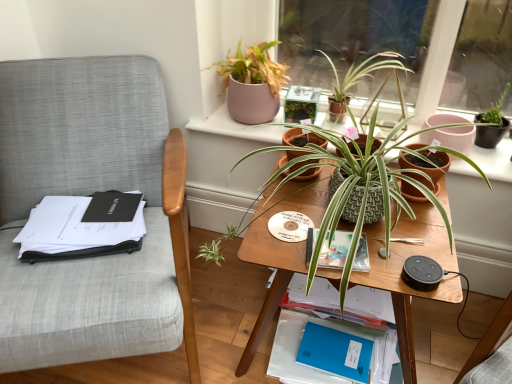
The width and height of the screenshot is (512, 384). In order to click on vacant area that is in front of hardcover book at center, which appears as the 2th paperback book when viewed from the back in this screenshot , I will do pos(350,267).